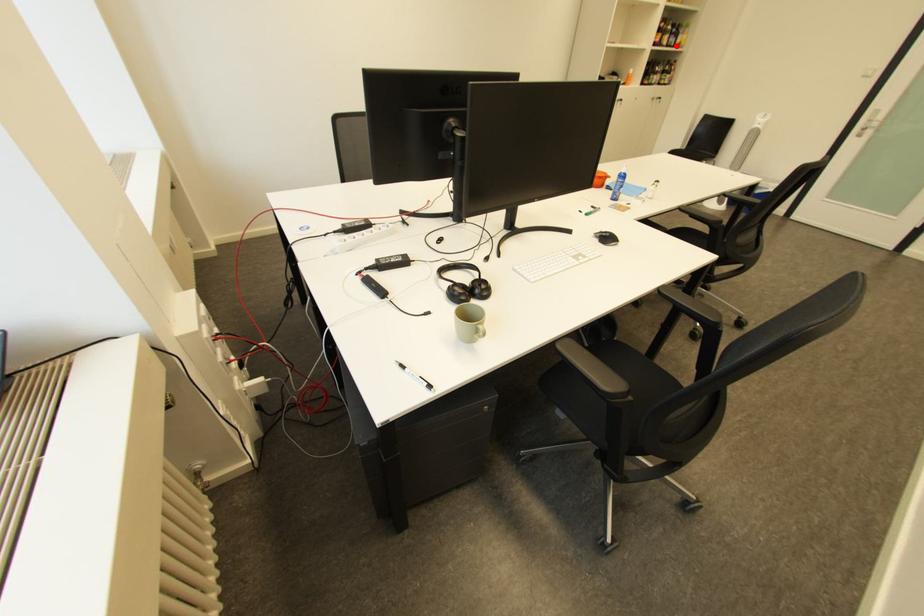
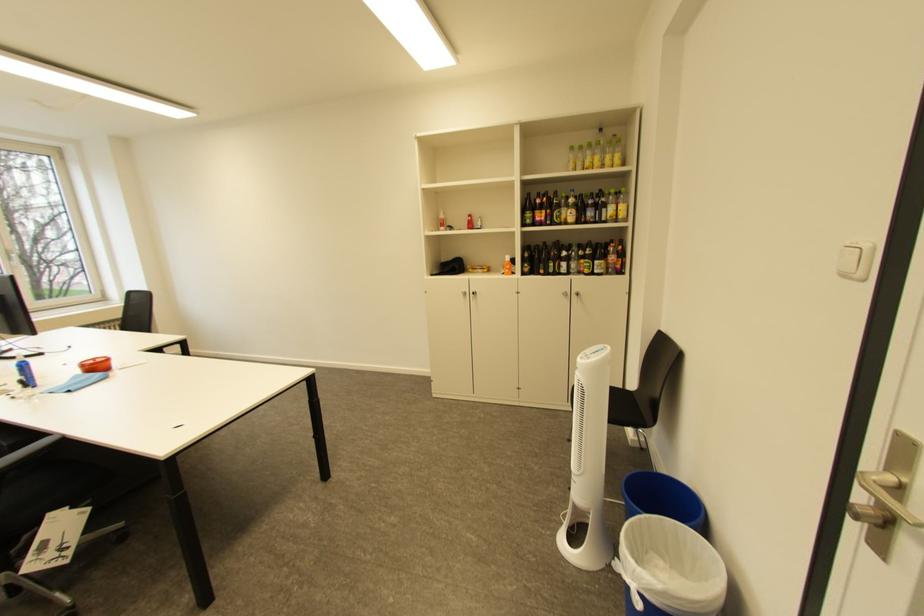
The point at the highlighted location is marked in the first image. Where is the corresponding point in the second image?

(587, 224)